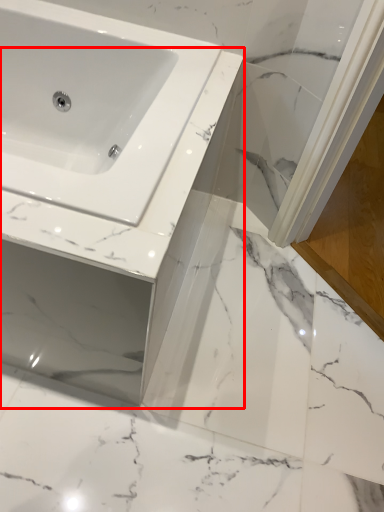
Question: From the image's perspective, what is the correct spatial relationship of counter top (annotated by the red box) in relation to screen door?

Choices:
 (A) below
 (B) above

Answer: (A)